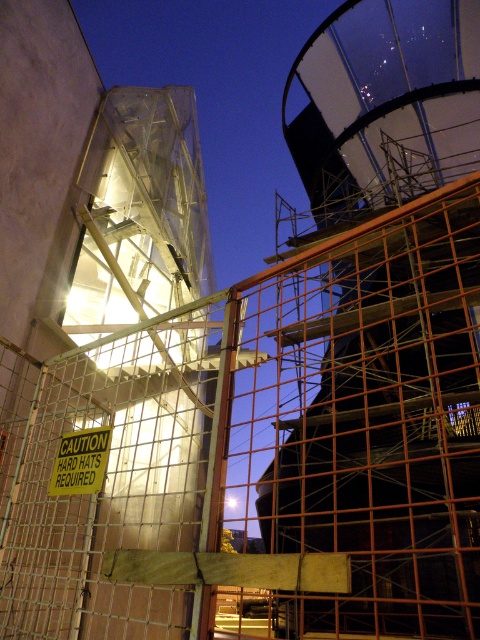
The width and height of the screenshot is (480, 640). In order to click on metal grid fence at center in this screenshot , I will do `click(271, 449)`.

Measure the distance from metal grid fence at center to yellow paper sign at center.

metal grid fence at center and yellow paper sign at center are 8.89 meters apart.

Is point (342, 582) positioned in front of point (84, 432)?

Yes, it is.

Find the location of `metal grid fence at center`. metal grid fence at center is located at coordinates (271, 449).